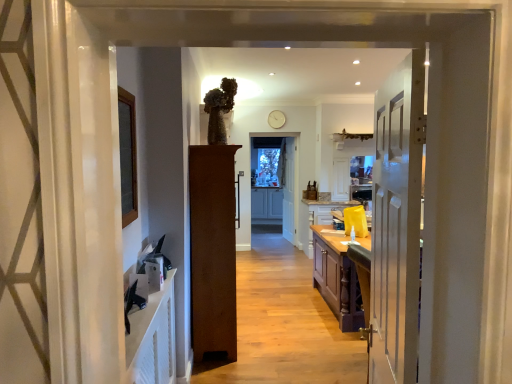
Where is `free space in front of white glossy cabinet at center`? free space in front of white glossy cabinet at center is located at coordinates (278, 249).